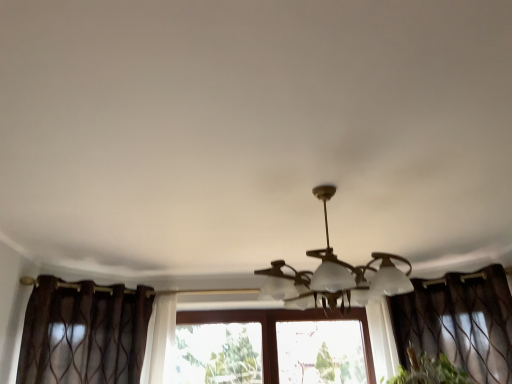
Question: Is brown sheer curtain at right, which ranks as the second curtain in left-to-right order, taller or shorter than matte white lamp at center?

Choices:
 (A) tall
 (B) short

Answer: (A)

Question: Is brown sheer curtain at right, which ranks as the second curtain in left-to-right order, in front of or behind matte white lamp at center in the image?

Choices:
 (A) front
 (B) behind

Answer: (B)

Question: Considering the real-world distances, which object is closest to the brown sheer curtain at left, arranged as the first curtain when viewed from the left?

Choices:
 (A) matte white lamp at center
 (B) brown sheer curtain at right, which ranks as the second curtain in left-to-right order

Answer: (A)

Question: Which of these objects is positioned farthest from the brown sheer curtain at left, positioned as the second curtain in right-to-left order?

Choices:
 (A) matte white lamp at center
 (B) brown sheer curtain at right, which is the first curtain from right to left

Answer: (B)